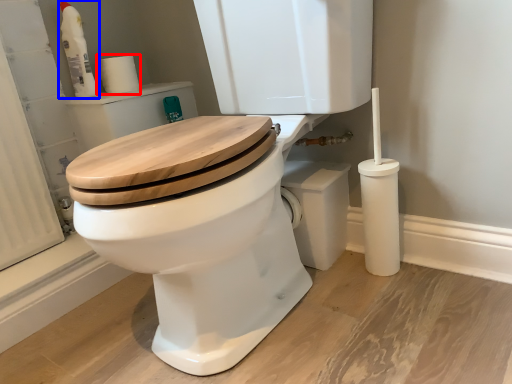
Question: Which object appears farthest to the camera in this image, toilet paper (highlighted by a red box) or cleaning product (highlighted by a blue box)?

Choices:
 (A) toilet paper
 (B) cleaning product

Answer: (A)